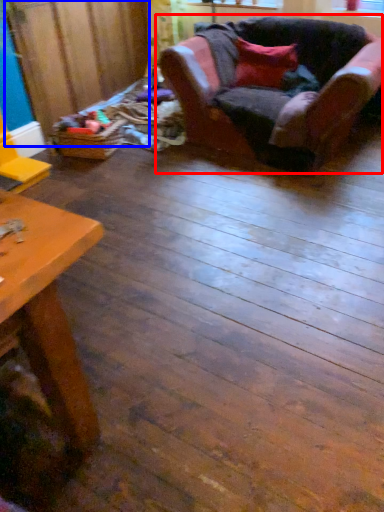
Question: Which point is further to the camera, chair (highlighted by a red box) or plywood (highlighted by a blue box)?

Choices:
 (A) chair
 (B) plywood

Answer: (B)